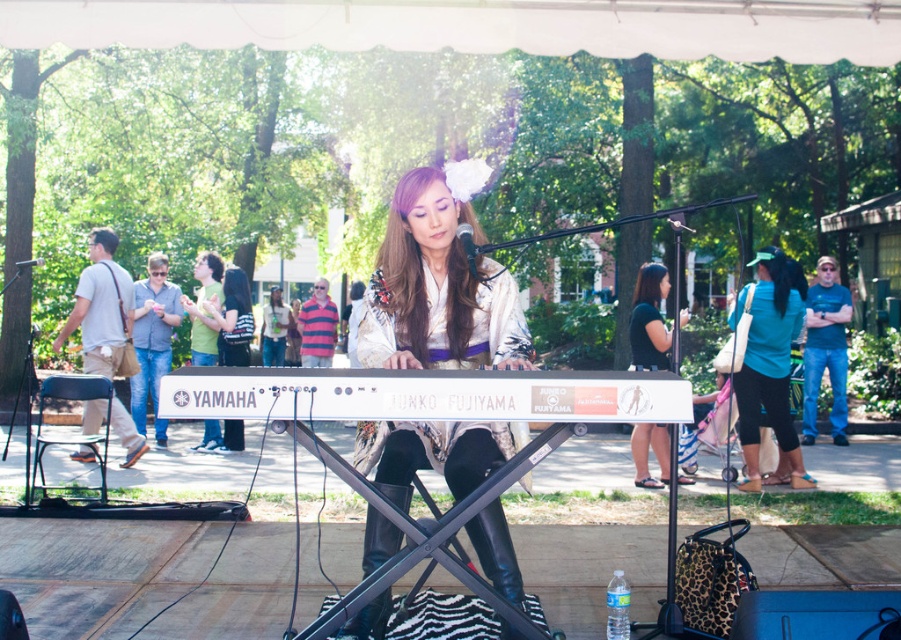
Which is behind, point (384, 451) or point (187, 308)?

Positioned behind is point (187, 308).

Is matte white kimono at center bigger than green fabric shirt at upper left?

Yes.

Which is behind, point (457, 253) or point (192, 342)?

Positioned behind is point (192, 342).

Where is `matte white kimono at center`? matte white kimono at center is located at coordinates (437, 289).

Who is more distant from viewer, [256,376] or [638,305]?

The point [638,305] is behind.

Locate an element on the screen. This screenshot has width=901, height=640. white matte keyboard at center is located at coordinates (425, 394).

The width and height of the screenshot is (901, 640). Describe the element at coordinates (437, 289) in the screenshot. I see `matte white kimono at center` at that location.

Between matte white kimono at center and denim jacket at center, which one has more height?

matte white kimono at center

Where is `matte white kimono at center`? The width and height of the screenshot is (901, 640). matte white kimono at center is located at coordinates (437, 289).

This screenshot has width=901, height=640. I want to click on matte white kimono at center, so click(437, 289).